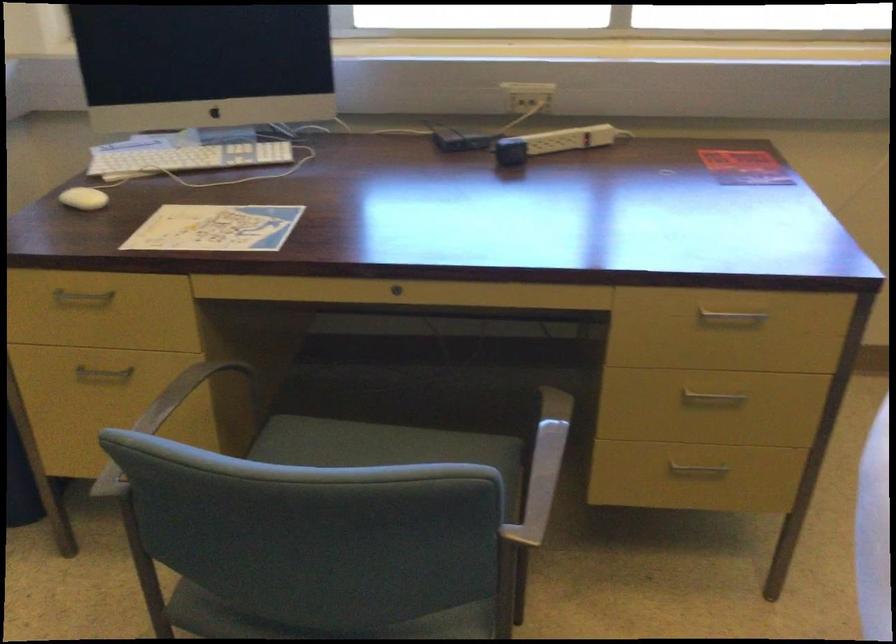
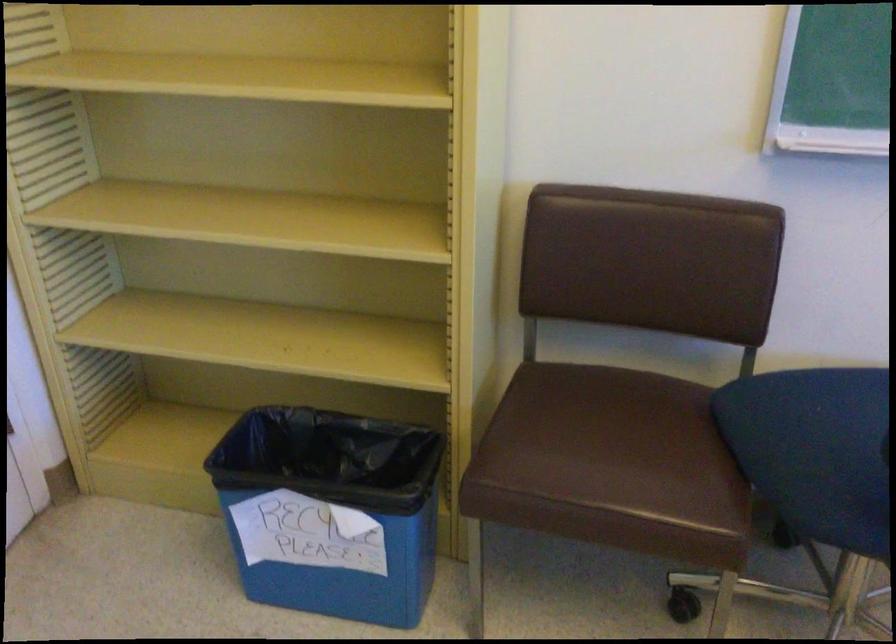
Based on the continuous images, in which direction is the camera rotating?

The camera's rotation is toward left-down.